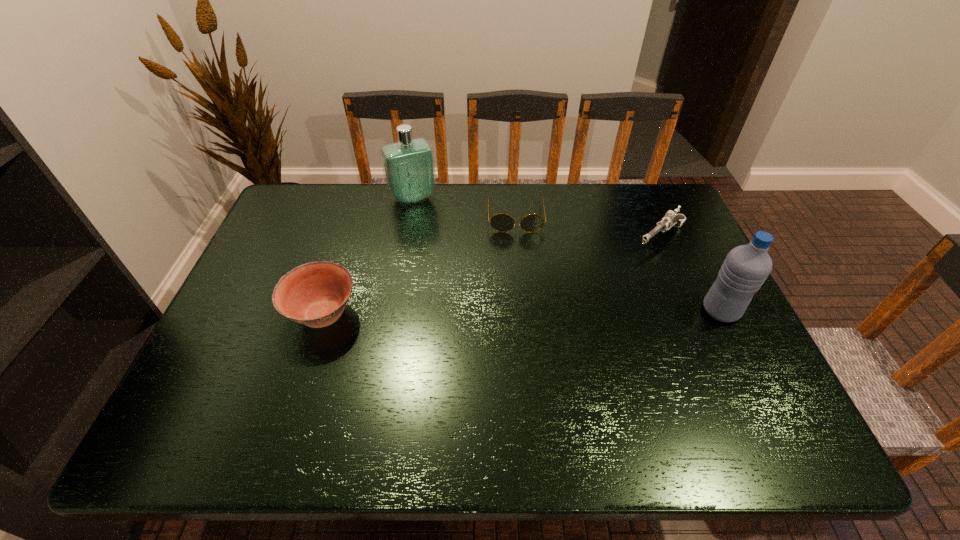
I want to click on vacant space situated on the lenses of the sunglasses, so click(521, 303).

At what (x,y) coordinates should I click in order to perform the action: click on vacant space located 0.350m aimed along the barrel of the gun. Please return your answer as a coordinate pair (x, y). Looking at the image, I should click on (567, 314).

The height and width of the screenshot is (540, 960). Identify the location of vacant space located aimed along the barrel of the gun. (612, 278).

Find the location of `vacant space located 0.380m aimed along the barrel of the gun`. vacant space located 0.380m aimed along the barrel of the gun is located at coordinates (560, 321).

Find the location of a particular element. The image size is (960, 540). vacant region located 0.100m on the front label of the perfume is located at coordinates (431, 227).

Locate an element on the screen. blank area located 0.070m on the front label of the perfume is located at coordinates (x=428, y=221).

You are a GUI agent. You are given a task and a screenshot of the screen. Output one action in this format:
    pyautogui.click(x=<x>, y=<y>)
    Task: Click on the vacant area situated on the front label of the perfume
    
    Given the screenshot: What is the action you would take?
    pyautogui.click(x=429, y=223)

What are the coordinates of `sunglasses situated at the far edge` in the screenshot? It's located at (501, 222).

Where is `gun that is at the far edge`? The height and width of the screenshot is (540, 960). gun that is at the far edge is located at coordinates (670, 218).

I want to click on perfume located in the far edge section of the desktop, so click(x=408, y=165).